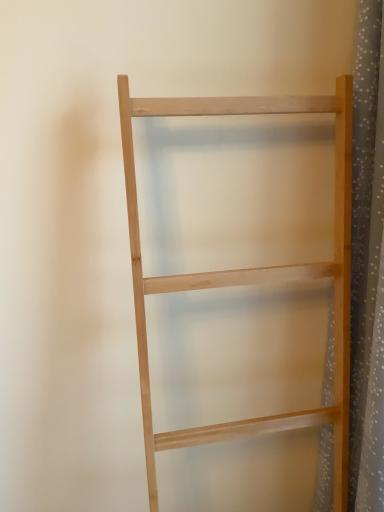
Where is `natural wood ladder at center`? natural wood ladder at center is located at coordinates (250, 274).

Measure the distance between point [225,431] and camera.

The distance of point [225,431] from camera is 29.88 inches.

What is the approximate height of natural wood ladder at center?

natural wood ladder at center is 36.73 inches in height.

Image resolution: width=384 pixels, height=512 pixels. Describe the element at coordinates (250, 274) in the screenshot. I see `natural wood ladder at center` at that location.

Where is `natural wood ladder at center`? This screenshot has height=512, width=384. natural wood ladder at center is located at coordinates (250, 274).